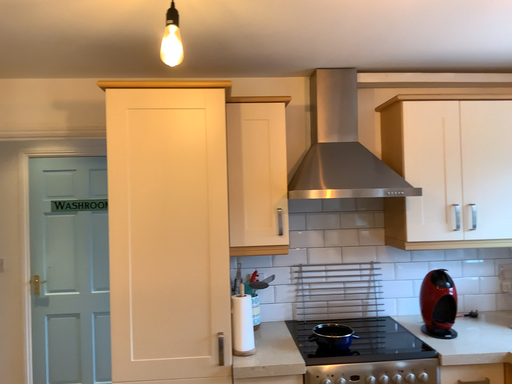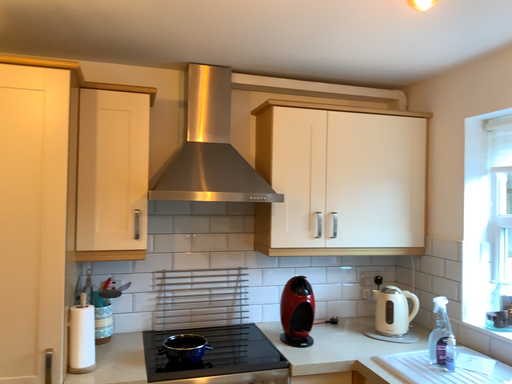
Question: Which way did the camera rotate in the video?

Choices:
 (A) rotated right
 (B) rotated left

Answer: (A)